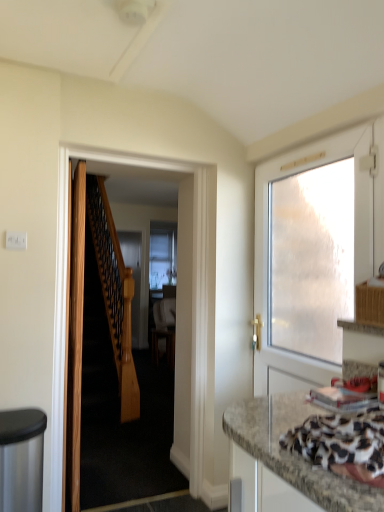
This screenshot has width=384, height=512. What do you see at coordinates (75, 334) in the screenshot?
I see `wooden door at left, positioned as the 3th door in right-to-left order` at bounding box center [75, 334].

Where is `wooden door at left, positioned as the 3th door in right-to-left order`? Image resolution: width=384 pixels, height=512 pixels. wooden door at left, positioned as the 3th door in right-to-left order is located at coordinates (75, 334).

Measure the distance between point (x=184, y=420) and camera.

A distance of 2.53 meters exists between point (x=184, y=420) and camera.

The image size is (384, 512). Identify the location of granite-patterned countertop at lower right. (285, 461).

Is granite-patterned countertop at lower right facing away from wooden door at left, positioned as the 3th door in right-to-left order?

No, granite-patterned countertop at lower right's orientation is not away from wooden door at left, positioned as the 3th door in right-to-left order.

In the scene shown: From a real-world perspective, which is physically below, granite-patterned countertop at lower right or wooden door at left, positioned as the 3th door in right-to-left order?

In real-world perspective, granite-patterned countertop at lower right is lower.

In the scene shown: Is wooden door at left, positioned as the 3th door in right-to-left order, inside granite-patterned countertop at lower right?

That's incorrect, wooden door at left, positioned as the 3th door in right-to-left order, is not inside granite-patterned countertop at lower right.

In the image, is granite-patterned countertop at lower right positioned in front of or behind wooden door at left, which ranks as the first door in left-to-right order?

granite-patterned countertop at lower right is positioned closer to the viewer than wooden door at left, which ranks as the first door in left-to-right order.

From the image's perspective, relative to granite-patterned countertop at lower right, is white frosted glass door at right, which is counted as the 3th door, starting from the left, above or below?

white frosted glass door at right, which is counted as the 3th door, starting from the left, is above granite-patterned countertop at lower right.

From a real-world perspective, is white frosted glass door at right, which ranks as the 1th door in right-to-left order, positioned above or below granite-patterned countertop at lower right?

white frosted glass door at right, which ranks as the 1th door in right-to-left order, is above granite-patterned countertop at lower right.

Is white frosted glass door at right, which is counted as the 3th door, starting from the left, far from granite-patterned countertop at lower right?

No, there isn't a large distance between white frosted glass door at right, which is counted as the 3th door, starting from the left, and granite-patterned countertop at lower right.

In the image, there is a granite-patterned countertop at lower right. At what (x,y) coordinates should I click in order to perform the action: click on door above it (from the image's perspective). Please return your answer as a coordinate pair (x, y). The height and width of the screenshot is (512, 384). Looking at the image, I should click on (354, 241).

The height and width of the screenshot is (512, 384). Find the location of `the 1st door directly beneath the white frosted glass door at right, which is counted as the 3th door, starting from the left (from a real-world perspective)`. the 1st door directly beneath the white frosted glass door at right, which is counted as the 3th door, starting from the left (from a real-world perspective) is located at coordinates (177, 308).

Looking at this image, could you tell me if wooden door at center, the second door when ordered from left to right, is turned towards white frosted glass door at right, which is counted as the 3th door, starting from the left?

No, wooden door at center, the second door when ordered from left to right, is not oriented towards white frosted glass door at right, which is counted as the 3th door, starting from the left.

In the scene shown: Which of these two, wooden door at center, the second door when ordered from left to right, or white frosted glass door at right, which ranks as the 1th door in right-to-left order, is thinner?

Thinner between the two is wooden door at center, the second door when ordered from left to right.

Is white frosted glass door at right, which is counted as the 3th door, starting from the left, located within wooden door at center, the second door when ordered from left to right?

Actually, white frosted glass door at right, which is counted as the 3th door, starting from the left, is outside wooden door at center, the second door when ordered from left to right.

Could wooden door at center, which ranks as the second door in right-to-left order, be considered to be inside white frosted glass door at right, which is counted as the 3th door, starting from the left?

Definitely not — wooden door at center, which ranks as the second door in right-to-left order, is not inside white frosted glass door at right, which is counted as the 3th door, starting from the left.

Considering the positions of point (257, 211) and point (195, 437), is point (257, 211) closer or farther from the camera than point (195, 437)?

Point (257, 211) is farther from the camera than point (195, 437).

Could you tell me if white frosted glass door at right, which ranks as the 1th door in right-to-left order, is facing wooden door at center, the second door when ordered from left to right?

Yes, white frosted glass door at right, which ranks as the 1th door in right-to-left order, is oriented towards wooden door at center, the second door when ordered from left to right.

Can you tell me how much white frosted glass door at right, which ranks as the 1th door in right-to-left order, and wooden door at center, the second door when ordered from left to right, differ in facing direction?

The angle between the facing direction of white frosted glass door at right, which ranks as the 1th door in right-to-left order, and the facing direction of wooden door at center, the second door when ordered from left to right, is 87.3 degrees.

Where is `the 2nd door to the left when counting from the white frosted glass door at right, which ranks as the 1th door in right-to-left order`? This screenshot has height=512, width=384. the 2nd door to the left when counting from the white frosted glass door at right, which ranks as the 1th door in right-to-left order is located at coordinates (75, 334).

Looking at their sizes, would you say white frosted glass door at right, which ranks as the 1th door in right-to-left order, is wider or thinner than wooden door at left, positioned as the 3th door in right-to-left order?

white frosted glass door at right, which ranks as the 1th door in right-to-left order, is wider than wooden door at left, positioned as the 3th door in right-to-left order.

From a real-world perspective, between white frosted glass door at right, which ranks as the 1th door in right-to-left order, and wooden door at left, positioned as the 3th door in right-to-left order, who is vertically lower?

From a 3D spatial view, wooden door at left, positioned as the 3th door in right-to-left order, is below.

In the scene shown: Considering the sizes of objects granite-patterned countertop at lower right and white frosted glass door at right, which is counted as the 3th door, starting from the left, in the image provided, who is bigger, granite-patterned countertop at lower right or white frosted glass door at right, which is counted as the 3th door, starting from the left,?

white frosted glass door at right, which is counted as the 3th door, starting from the left.

Is granite-patterned countertop at lower right turned away from white frosted glass door at right, which is counted as the 3th door, starting from the left?

No, granite-patterned countertop at lower right is not facing away from white frosted glass door at right, which is counted as the 3th door, starting from the left.

From a real-world perspective, between granite-patterned countertop at lower right and white frosted glass door at right, which ranks as the 1th door in right-to-left order, who is vertically higher?

From a 3D spatial view, white frosted glass door at right, which ranks as the 1th door in right-to-left order, is above.

Is there a large distance between granite-patterned countertop at lower right and white frosted glass door at right, which ranks as the 1th door in right-to-left order?

granite-patterned countertop at lower right is near white frosted glass door at right, which ranks as the 1th door in right-to-left order, not far away.

From a real-world perspective, who is located lower, wooden door at left, which ranks as the first door in left-to-right order, or granite-patterned countertop at lower right?

granite-patterned countertop at lower right, from a real-world perspective.

Does point (83, 183) lie behind point (259, 497)?

Yes, it is behind point (259, 497).

Is wooden door at left, positioned as the 3th door in right-to-left order, positioned beyond the bounds of granite-patterned countertop at lower right?

Yes, wooden door at left, positioned as the 3th door in right-to-left order, is outside of granite-patterned countertop at lower right.

Is granite-patterned countertop at lower right at the back of wooden door at left, which ranks as the first door in left-to-right order?

No, granite-patterned countertop at lower right is not at the back of wooden door at left, which ranks as the first door in left-to-right order.

You are a GUI agent. You are given a task and a screenshot of the screen. Output one action in this format:
    pyautogui.click(x=<x>, y=<y>)
    Task: Click on the countertop above the wooden door at left, which ranks as the first door in left-to-right order (from the image's perspective)
    The width and height of the screenshot is (384, 512).
    Given the screenshot: What is the action you would take?
    pyautogui.click(x=285, y=461)

You are a GUI agent. You are given a task and a screenshot of the screen. Output one action in this format:
    pyautogui.click(x=<x>, y=<y>)
    Task: Click on the 3rd door located above the granite-patterned countertop at lower right (from a real-world perspective)
    Image resolution: width=384 pixels, height=512 pixels.
    Given the screenshot: What is the action you would take?
    pyautogui.click(x=354, y=241)

Looking at this image, which object lies nearer to the anchor point white frosted glass door at right, which is counted as the 3th door, starting from the left, wooden door at center, the second door when ordered from left to right, or granite-patterned countertop at lower right?

Based on the image, wooden door at center, the second door when ordered from left to right, appears to be nearer to white frosted glass door at right, which is counted as the 3th door, starting from the left.

Estimate the real-world distances between objects in this image. Which object is further from granite-patterned countertop at lower right, white frosted glass door at right, which is counted as the 3th door, starting from the left, or wooden door at center, the second door when ordered from left to right?

Among the two, wooden door at center, the second door when ordered from left to right, is located further to granite-patterned countertop at lower right.

Considering their positions, is granite-patterned countertop at lower right positioned further to white frosted glass door at right, which is counted as the 3th door, starting from the left, than wooden door at center, the second door when ordered from left to right?

granite-patterned countertop at lower right is further to white frosted glass door at right, which is counted as the 3th door, starting from the left.

Estimate the real-world distances between objects in this image. Which object is closer to wooden door at left, positioned as the 3th door in right-to-left order, white frosted glass door at right, which is counted as the 3th door, starting from the left, or granite-patterned countertop at lower right?

The object closer to wooden door at left, positioned as the 3th door in right-to-left order, is white frosted glass door at right, which is counted as the 3th door, starting from the left.

When comparing their distances from wooden door at center, the second door when ordered from left to right, does granite-patterned countertop at lower right or white frosted glass door at right, which is counted as the 3th door, starting from the left, seem further?

The object further to wooden door at center, the second door when ordered from left to right, is granite-patterned countertop at lower right.

From the image, which object appears to be nearer to white frosted glass door at right, which ranks as the 1th door in right-to-left order, wooden door at left, positioned as the 3th door in right-to-left order, or wooden door at center, which ranks as the second door in right-to-left order?

wooden door at center, which ranks as the second door in right-to-left order.

In the scene shown: Which object lies further to the anchor point granite-patterned countertop at lower right, wooden door at center, the second door when ordered from left to right, or wooden door at left, positioned as the 3th door in right-to-left order?

wooden door at left, positioned as the 3th door in right-to-left order.

When comparing their distances from wooden door at center, which ranks as the second door in right-to-left order, does wooden door at left, positioned as the 3th door in right-to-left order, or granite-patterned countertop at lower right seem closer?

Among the two, wooden door at left, positioned as the 3th door in right-to-left order, is located nearer to wooden door at center, which ranks as the second door in right-to-left order.

Find the location of a particular element. door between granite-patterned countertop at lower right and wooden door at center, the second door when ordered from left to right, along the z-axis is located at coordinates (354, 241).

I want to click on door between wooden door at left, which ranks as the first door in left-to-right order, and white frosted glass door at right, which ranks as the 1th door in right-to-left order, from left to right, so click(x=177, y=308).